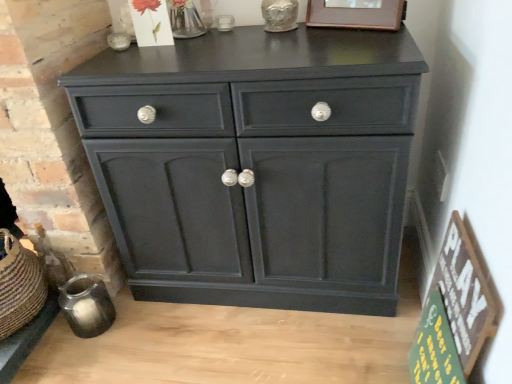
Find the location of `free space in front of wooden picture frame at upper center`. free space in front of wooden picture frame at upper center is located at coordinates (359, 41).